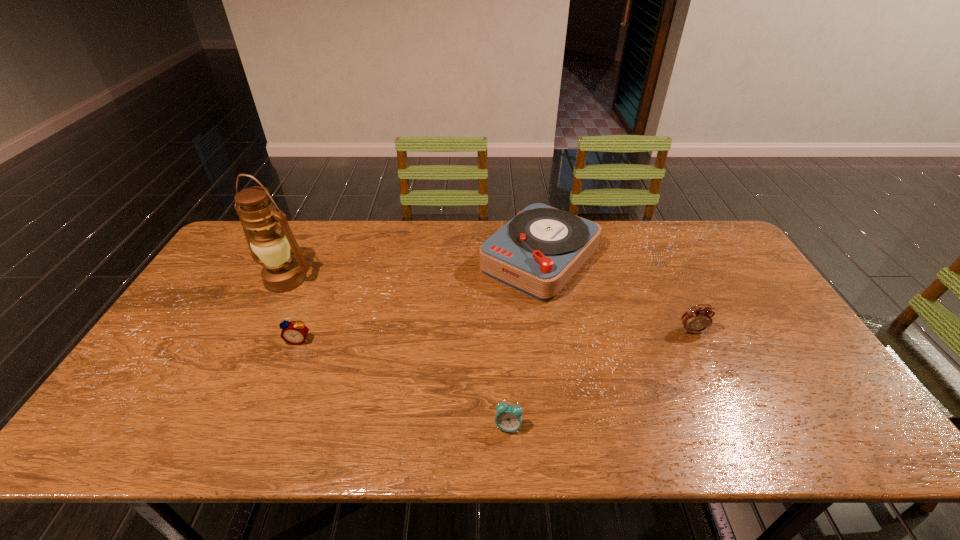
Where is `free spot between the tallest object and the leftmost alarm clock`? Image resolution: width=960 pixels, height=540 pixels. free spot between the tallest object and the leftmost alarm clock is located at coordinates (292, 309).

Where is `unoccupied area between the second tallest object and the leftmost alarm clock`? The image size is (960, 540). unoccupied area between the second tallest object and the leftmost alarm clock is located at coordinates (420, 300).

I want to click on free point between the leftmost alarm clock and the nearest object, so click(403, 383).

Locate an element on the screen. The width and height of the screenshot is (960, 540). free space between the leftmost alarm clock and the rightmost object is located at coordinates (495, 335).

Locate an element on the screen. This screenshot has height=540, width=960. free point between the second tallest object and the leftmost alarm clock is located at coordinates (420, 300).

Locate an element on the screen. This screenshot has height=540, width=960. vacant area between the nearest object and the rightmost alarm clock is located at coordinates (600, 379).

You are a GUI agent. You are given a task and a screenshot of the screen. Output one action in this format:
    pyautogui.click(x=<x>, y=<y>)
    Task: Click on the vacant space that's between the nearest object and the second tallest object
    
    Given the screenshot: What is the action you would take?
    pyautogui.click(x=524, y=343)

This screenshot has width=960, height=540. I want to click on empty space that is in between the tallest object and the rightmost object, so click(489, 305).

Where is `object that is the second closest to the leftmost alarm clock`? Image resolution: width=960 pixels, height=540 pixels. object that is the second closest to the leftmost alarm clock is located at coordinates (537, 252).

You are a GUI agent. You are given a task and a screenshot of the screen. Output one action in this format:
    pyautogui.click(x=<x>, y=<y>)
    Task: Click on the object that stands as the fourth closest to the second tallest object
    The height and width of the screenshot is (540, 960).
    Given the screenshot: What is the action you would take?
    pyautogui.click(x=270, y=247)